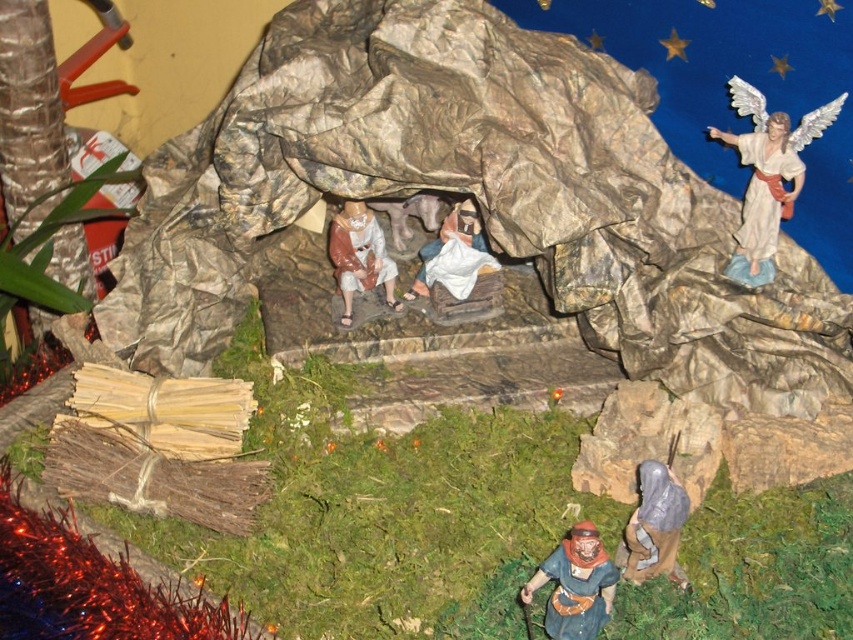
Is smooth beige robe at center positioned at the back of white cloth at center?

No, it is in front of white cloth at center.

Consider the image. Can you confirm if smooth beige robe at center is taller than white cloth at center?

Correct, smooth beige robe at center is much taller as white cloth at center.

Image resolution: width=853 pixels, height=640 pixels. What are the coordinates of `smooth beige robe at center` in the screenshot? It's located at (358, 257).

What do you see at coordinates (575, 584) in the screenshot? Image resolution: width=853 pixels, height=640 pixels. I see `brown painted wood figure at lower center` at bounding box center [575, 584].

This screenshot has width=853, height=640. Describe the element at coordinates (575, 584) in the screenshot. I see `brown painted wood figure at lower center` at that location.

Identify the location of brown painted wood figure at lower center. (575, 584).

Is gray fabric figure at lower right smaller than white cloth at center?

Correct, gray fabric figure at lower right occupies less space than white cloth at center.

Who is more forward, (635, 541) or (438, 246)?

Point (635, 541)

This screenshot has height=640, width=853. Identify the location of gray fabric figure at lower right. (653, 525).

Identify the location of gray fabric figure at lower right. The image size is (853, 640). (653, 525).